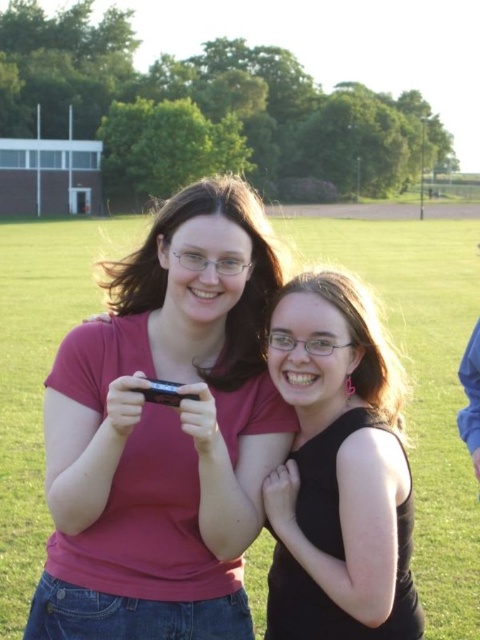
Image resolution: width=480 pixels, height=640 pixels. In order to click on matte pink shirt at center in this screenshot , I will do `click(165, 433)`.

Does matte pink shirt at center have a lesser height compared to black matte tank top at center?

Incorrect, matte pink shirt at center's height does not fall short of black matte tank top at center's.

This screenshot has width=480, height=640. I want to click on matte pink shirt at center, so click(x=165, y=433).

Locate an element on the screen. The height and width of the screenshot is (640, 480). matte pink shirt at center is located at coordinates (165, 433).